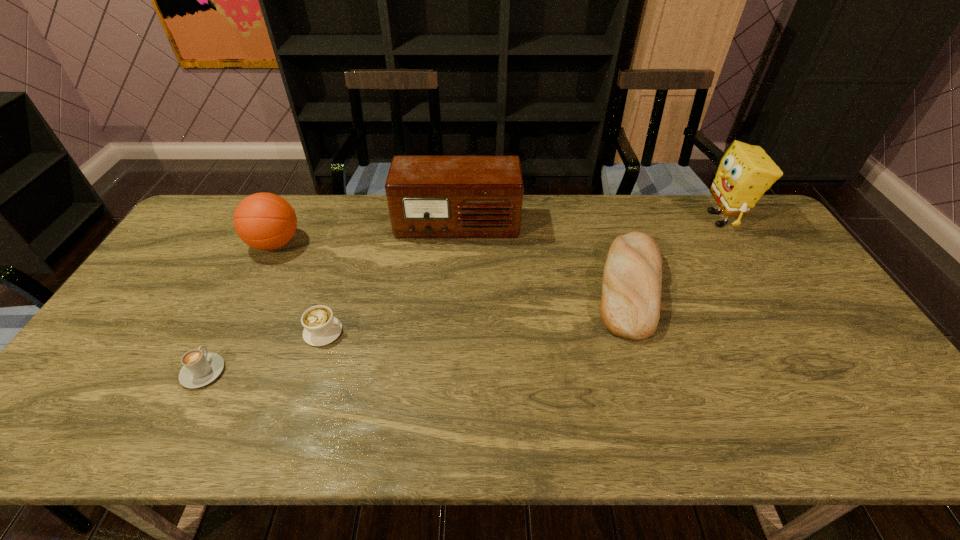
Where is `free spot at the far left corner of the desktop`? Image resolution: width=960 pixels, height=540 pixels. free spot at the far left corner of the desktop is located at coordinates (217, 224).

Image resolution: width=960 pixels, height=540 pixels. In the image, there is a desktop. What are the coordinates of `vacant region at the far right corner` in the screenshot? It's located at (743, 218).

The height and width of the screenshot is (540, 960). In order to click on vacant space at the near right corner of the desktop in this screenshot , I will do `click(894, 434)`.

Find the location of `free space between the fourth object from left to right and the farther cappuccino`. free space between the fourth object from left to right and the farther cappuccino is located at coordinates (391, 279).

You are a GUI agent. You are given a task and a screenshot of the screen. Output one action in this format:
    pyautogui.click(x=<x>, y=<y>)
    Task: Click on the vacant space in between the fourth object from left to right and the right cappuccino
    This screenshot has height=540, width=960.
    Given the screenshot: What is the action you would take?
    pyautogui.click(x=391, y=279)

Where is `vacant area that lies between the bread and the radio receiver`? The height and width of the screenshot is (540, 960). vacant area that lies between the bread and the radio receiver is located at coordinates (543, 256).

Where is `vacant point located between the fourth object from left to right and the tallest object`? Image resolution: width=960 pixels, height=540 pixels. vacant point located between the fourth object from left to right and the tallest object is located at coordinates (589, 222).

You are a GUI agent. You are given a task and a screenshot of the screen. Output one action in this format:
    pyautogui.click(x=<x>, y=<y>)
    Task: Click on the vacant space in between the right cappuccino and the third shortest object
    The height and width of the screenshot is (540, 960).
    Given the screenshot: What is the action you would take?
    pyautogui.click(x=476, y=309)

The height and width of the screenshot is (540, 960). In order to click on empty space that is in between the fourth shortest object and the nearer cappuccino in this screenshot , I will do `click(239, 308)`.

Identify the location of free space between the basketball and the right cappuccino. (300, 288).